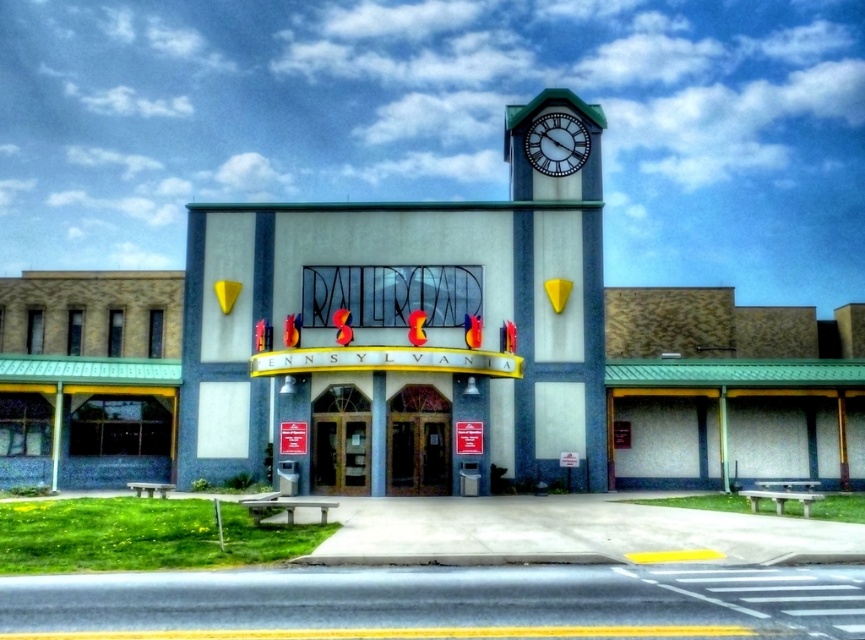
Question: Which point is farther from the camera taking this photo?

Choices:
 (A) (580, 141)
 (B) (767, 362)

Answer: (A)

Question: Can you confirm if white painted concrete clock tower at upper right is wider than white glossy clock at upper center?

Choices:
 (A) yes
 (B) no

Answer: (A)

Question: Which object is the closest to the white glossy clock at upper center?

Choices:
 (A) green matte bench at lower right
 (B) white painted concrete clock tower at upper right

Answer: (B)

Question: Which of the following is the farthest from the observer?

Choices:
 (A) white painted concrete clock tower at upper right
 (B) green matte bench at lower right

Answer: (B)

Question: Is white painted concrete clock tower at upper right to the right of white glossy clock at upper center from the viewer's perspective?

Choices:
 (A) yes
 (B) no

Answer: (B)

Question: Is white painted concrete clock tower at upper right above green matte bench at lower right?

Choices:
 (A) yes
 (B) no

Answer: (A)